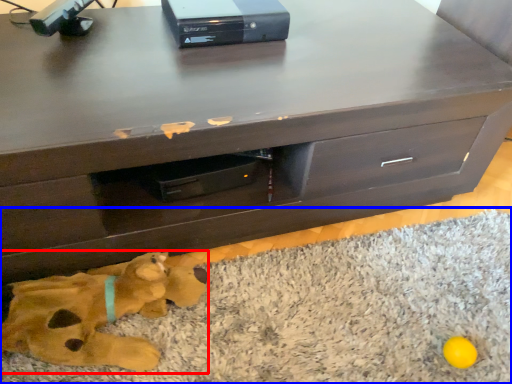
Question: Which of the following is the farthest to the observer, animal (highlighted by a red box) or mat (highlighted by a blue box)?

Choices:
 (A) animal
 (B) mat

Answer: (A)